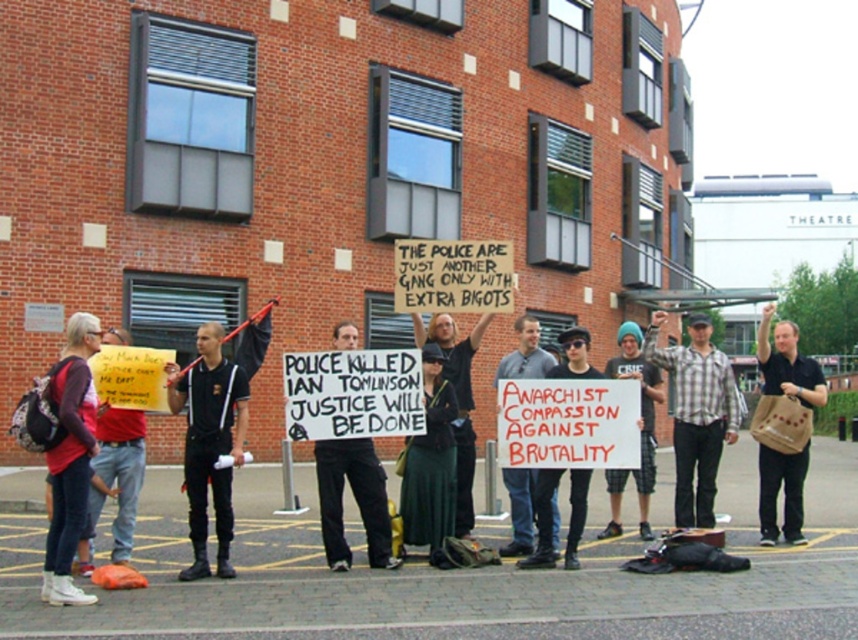
Between point (442, 397) and point (372, 452), which one is positioned in front?

Point (372, 452) is in front.

Does green fabric skirt at center have a greater width compared to black cotton pants at center?

No.

Which is in front, point (448, 499) or point (334, 326)?

Positioned in front is point (448, 499).

This screenshot has height=640, width=858. Identify the location of green fabric skirt at center. (430, 465).

Can you confirm if green fabric skirt at center is thinner than blue knit cap at center?

Incorrect, green fabric skirt at center's width is not less than blue knit cap at center's.

Does green fabric skirt at center lie in front of blue knit cap at center?

Yes, it is in front of blue knit cap at center.

Image resolution: width=858 pixels, height=640 pixels. Find the location of `green fabric skirt at center`. green fabric skirt at center is located at coordinates (430, 465).

You are a GUI agent. You are given a task and a screenshot of the screen. Output one action in this format:
    pyautogui.click(x=<x>, y=<y>)
    Task: Click on the green fabric skirt at center
    The height and width of the screenshot is (640, 858).
    Given the screenshot: What is the action you would take?
    pyautogui.click(x=430, y=465)

Does plaid shirt at center come in front of white paper sign at center?

Yes, it is.

I want to click on plaid shirt at center, so click(696, 413).

Locate an element on the screen. The image size is (858, 640). plaid shirt at center is located at coordinates (696, 413).